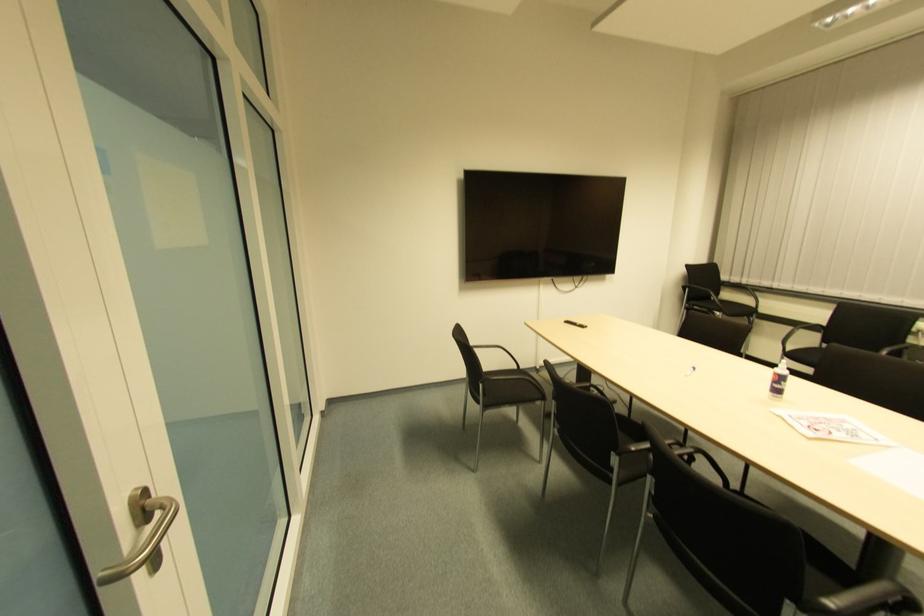
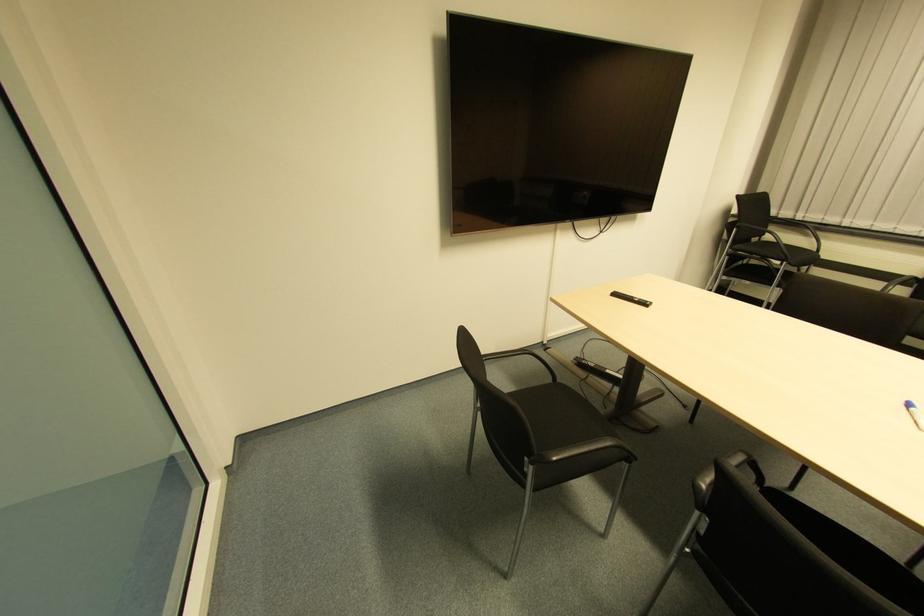
In the second image, find the point that corresponds to pixel 579 330 in the first image.

(641, 306)